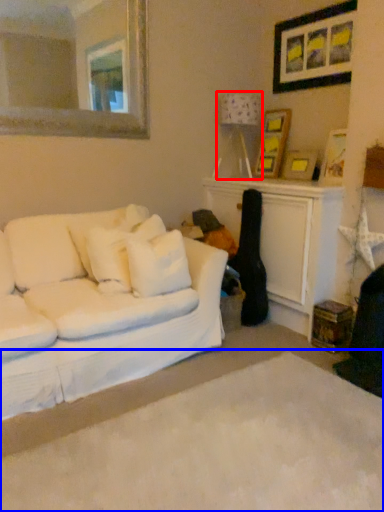
Question: Which of the following is the farthest to the observer, lamp (highlighted by a red box) or plain (highlighted by a blue box)?

Choices:
 (A) lamp
 (B) plain

Answer: (A)